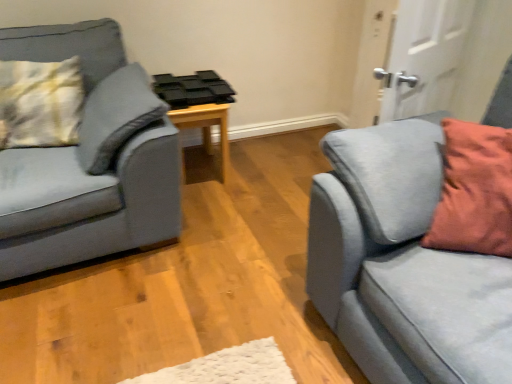
Question: Can you confirm if black plastic tray at center is smaller than yellow-green textured pillow at left?

Choices:
 (A) yes
 (B) no

Answer: (B)

Question: From a real-world perspective, is black plastic tray at center positioned under yellow-green textured pillow at left based on gravity?

Choices:
 (A) no
 (B) yes

Answer: (B)

Question: From the image's perspective, is black plastic tray at center located beneath yellow-green textured pillow at left?

Choices:
 (A) yes
 (B) no

Answer: (A)

Question: Considering the relative sizes of black plastic tray at center and yellow-green textured pillow at left in the image provided, is black plastic tray at center thinner than yellow-green textured pillow at left?

Choices:
 (A) no
 (B) yes

Answer: (A)

Question: Is black plastic tray at center bigger than yellow-green textured pillow at left?

Choices:
 (A) no
 (B) yes

Answer: (B)

Question: From the image's perspective, does black plastic tray at center appear higher than yellow-green textured pillow at left?

Choices:
 (A) yes
 (B) no

Answer: (B)

Question: Can you confirm if black plastic tray at center is taller than velvet grey couch at left, the second studio couch in the right-to-left sequence?

Choices:
 (A) no
 (B) yes

Answer: (A)

Question: Is velvet grey couch at left, placed as the first studio couch when sorted from left to right, at the back of black plastic tray at center?

Choices:
 (A) no
 (B) yes

Answer: (A)

Question: Is black plastic tray at center positioned behind velvet grey couch at left, the second studio couch in the right-to-left sequence?

Choices:
 (A) no
 (B) yes

Answer: (B)

Question: Is black plastic tray at center at the right side of velvet grey couch at left, the second studio couch in the right-to-left sequence?

Choices:
 (A) yes
 (B) no

Answer: (A)

Question: Does black plastic tray at center have a larger size compared to velvet grey couch at left, placed as the first studio couch when sorted from left to right?

Choices:
 (A) no
 (B) yes

Answer: (A)

Question: Is black plastic tray at center surrounding velvet grey couch at left, the second studio couch in the right-to-left sequence?

Choices:
 (A) no
 (B) yes

Answer: (A)

Question: From a real-world perspective, is yellow-green textured pillow at left located beneath white matte door at upper right?

Choices:
 (A) no
 (B) yes

Answer: (B)